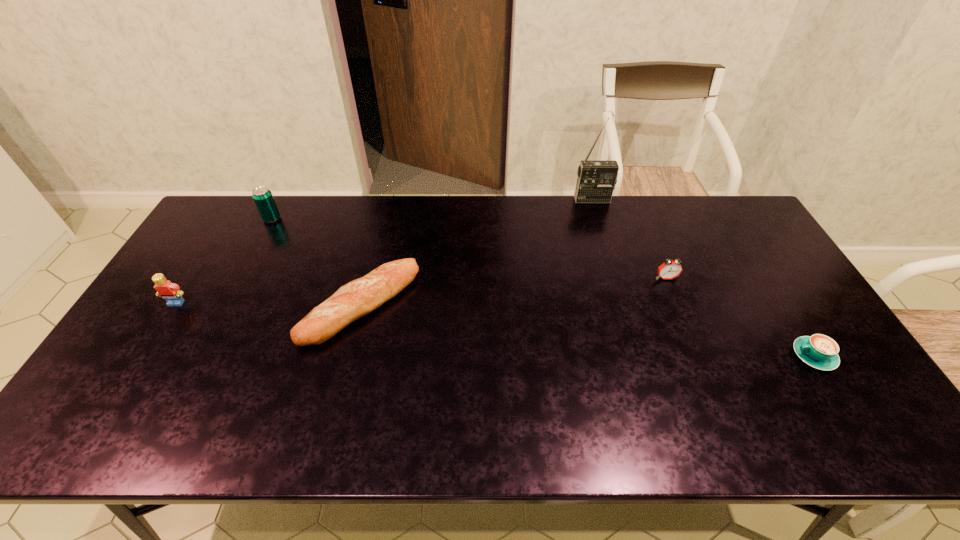
The height and width of the screenshot is (540, 960). What are the coordinates of `the third object from right to left` in the screenshot? It's located at (596, 180).

I want to click on the tallest object, so click(596, 180).

Identify the location of the second farthest object. (262, 196).

Locate an element on the screen. beer can is located at coordinates (262, 196).

Identify the location of Lego. Image resolution: width=960 pixels, height=540 pixels. [169, 291].

In order to click on alarm clock in this screenshot , I will do `click(669, 269)`.

Locate an element on the screen. The height and width of the screenshot is (540, 960). baguet is located at coordinates (359, 297).

What are the coordinates of `cappuccino` in the screenshot? It's located at (819, 351).

The height and width of the screenshot is (540, 960). What are the coordinates of `the shortest object` in the screenshot? It's located at (819, 351).

Where is `blank area located 0.320m on the display of the tallest object`? The image size is (960, 540). blank area located 0.320m on the display of the tallest object is located at coordinates (612, 265).